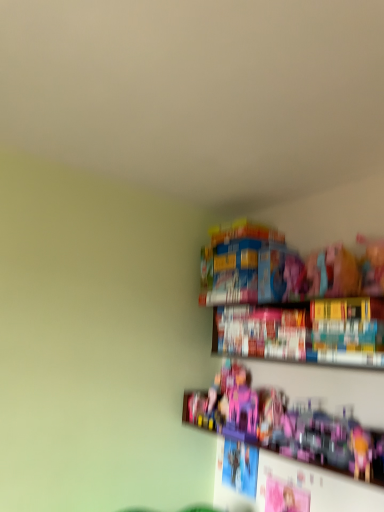
Question: Looking at the image, does pink plastic castle at center, acting as the first toy starting from the left, seem bigger or smaller compared to hardcover book at upper right?

Choices:
 (A) small
 (B) big

Answer: (A)

Question: In the image, is pink plastic castle at center, acting as the first toy starting from the left, positioned in front of or behind hardcover book at upper right?

Choices:
 (A) front
 (B) behind

Answer: (B)

Question: Estimate the real-world distances between objects in this image. Which object is closer to the pink plastic castle at center, acting as the first toy starting from the left?

Choices:
 (A) hardcover book at upper right
 (B) pink plastic toy at lower right, arranged as the second toy when viewed from the left

Answer: (B)

Question: Which object is positioned closest to the pink plastic castle at center, which is the 2th toy from right to left?

Choices:
 (A) hardcover book at upper right
 (B) pink plastic toy at lower right, arranged as the second toy when viewed from the left

Answer: (B)